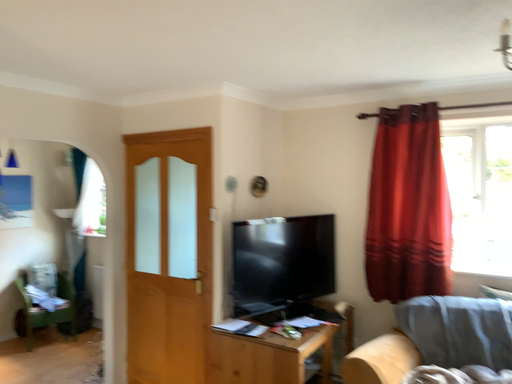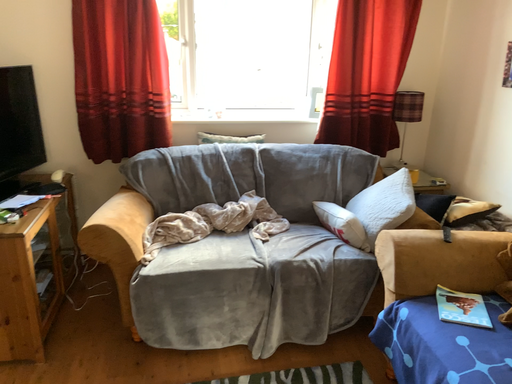
Question: Which way did the camera rotate in the video?

Choices:
 (A) rotated upward
 (B) rotated downward

Answer: (B)